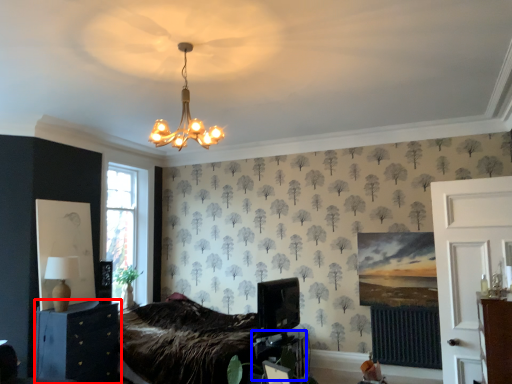
Question: Which object is further to the camera taking this photo, furniture (highlighted by a red box) or table (highlighted by a blue box)?

Choices:
 (A) furniture
 (B) table

Answer: (B)